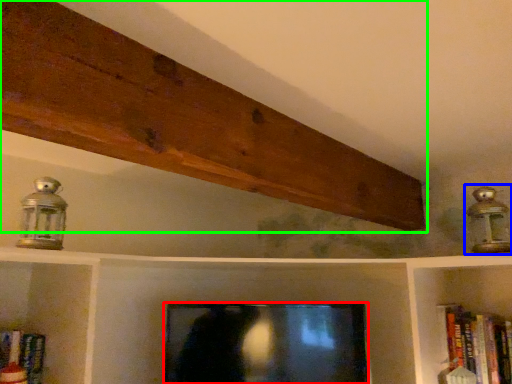
Question: Which object is positioned closest to television (highlighted by a red box)? Select from lamp (highlighted by a blue box) and plank (highlighted by a green box).

Choices:
 (A) lamp
 (B) plank

Answer: (B)